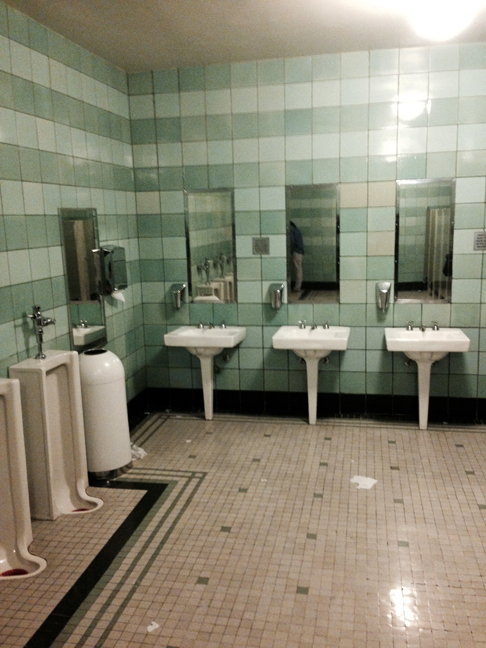
You are a GUI agent. You are given a task and a screenshot of the screen. Output one action in this format:
    pyautogui.click(x=<x>, y=<y>)
    Task: Click on the napkin dispenser
    The width and height of the screenshot is (486, 648).
    Given the screenshot: What is the action you would take?
    pyautogui.click(x=110, y=266)